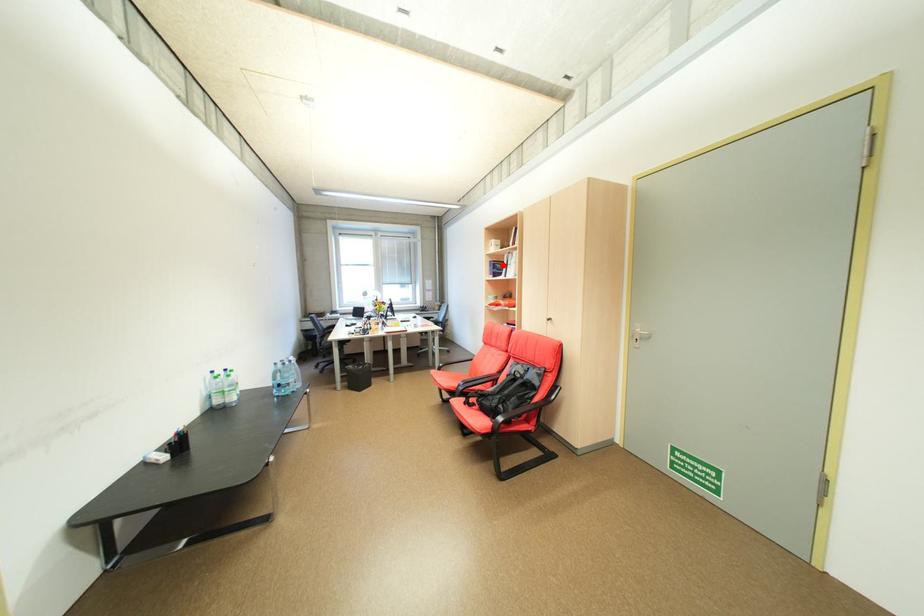
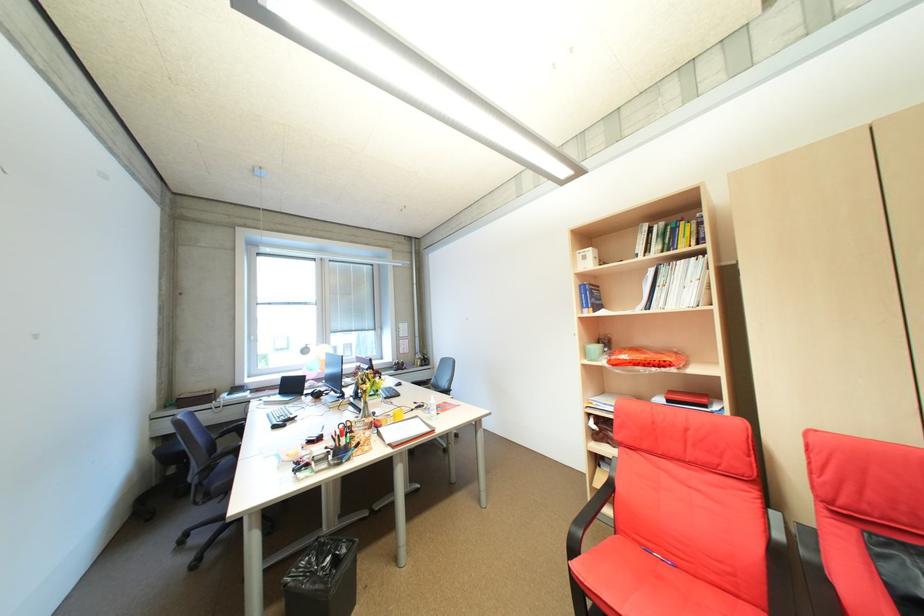
Question: I am providing you with two images of the same scene from different viewpoints. A red point is shown in image1. For the corresponding object point in image2, is it positioned nearer or farther from the camera?

Choices:
 (A) Nearer
 (B) Farther

Answer: (B)